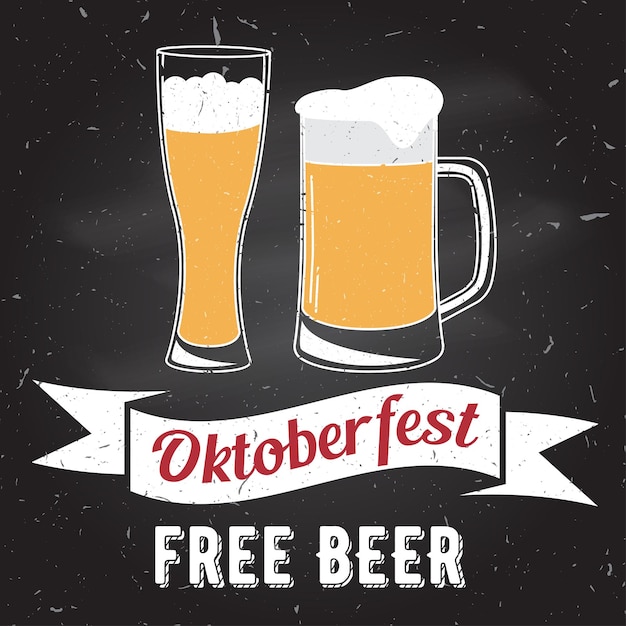
Image resolution: width=626 pixels, height=626 pixels. In order to click on wider beer glass in this screenshot , I will do `click(387, 228)`.